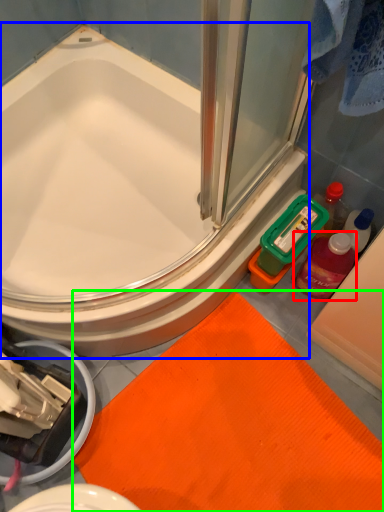
Question: Which is farther away from mouthwash (highlighted by a red box)? bathtub (highlighted by a blue box) or bath mat (highlighted by a green box)?

Choices:
 (A) bathtub
 (B) bath mat

Answer: (A)